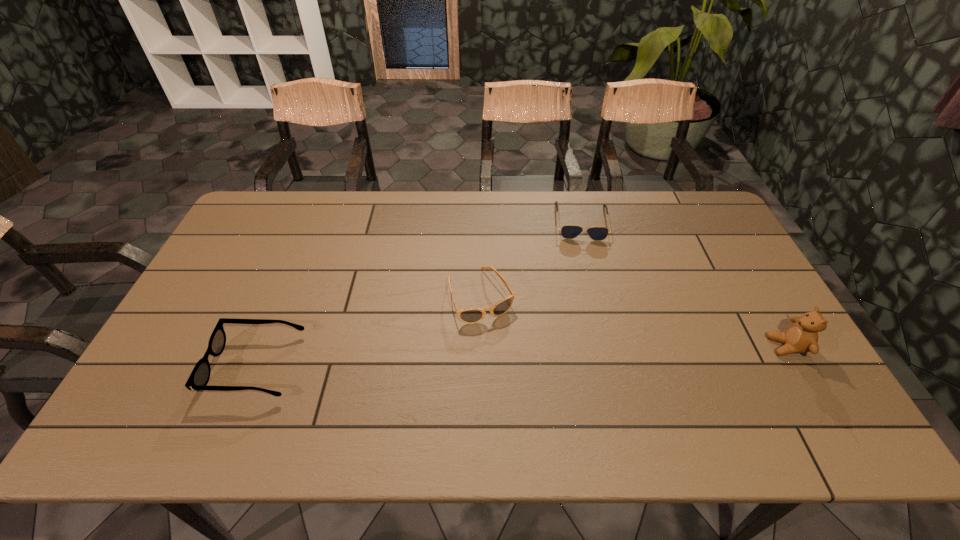
I want to click on free area in between the teddy bear and the third object from right to left, so click(x=634, y=321).

Identify the location of empty space that is in between the nearer sunglasses and the spectacles. Image resolution: width=960 pixels, height=540 pixels. (369, 330).

Find the location of `free space between the farthest object and the left sunglasses`. free space between the farthest object and the left sunglasses is located at coordinates (531, 259).

Where is `free space that is in between the rightmost object and the spectacles`? free space that is in between the rightmost object and the spectacles is located at coordinates tap(521, 356).

Where is `vacant area that lies between the rightmost object and the leftmost object`? vacant area that lies between the rightmost object and the leftmost object is located at coordinates (521, 356).

Where is `unoccupied position between the second farthest object and the right sunglasses`? The width and height of the screenshot is (960, 540). unoccupied position between the second farthest object and the right sunglasses is located at coordinates (531, 259).

At what (x,y) coordinates should I click in order to perform the action: click on vacant region between the second object from right to left and the leftmost object. Please return your answer as a coordinate pair (x, y). The width and height of the screenshot is (960, 540). Looking at the image, I should click on (419, 294).

Identify the location of unoccupied area between the nearer sunglasses and the spectacles. (369, 330).

The image size is (960, 540). I want to click on vacant area that lies between the rightmost object and the leftmost object, so click(521, 356).

In order to click on free area in between the tallest object and the leftmost object in this screenshot , I will do `click(521, 356)`.